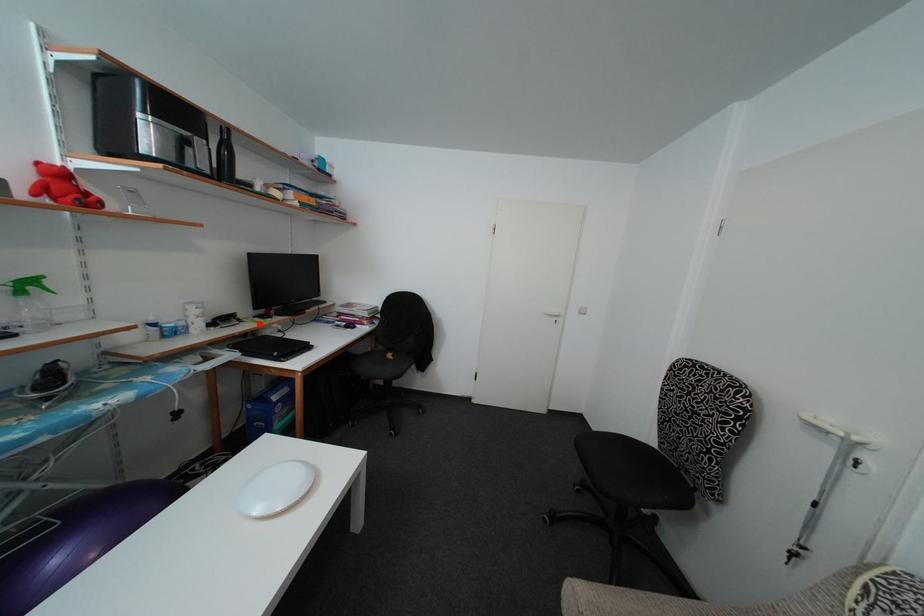
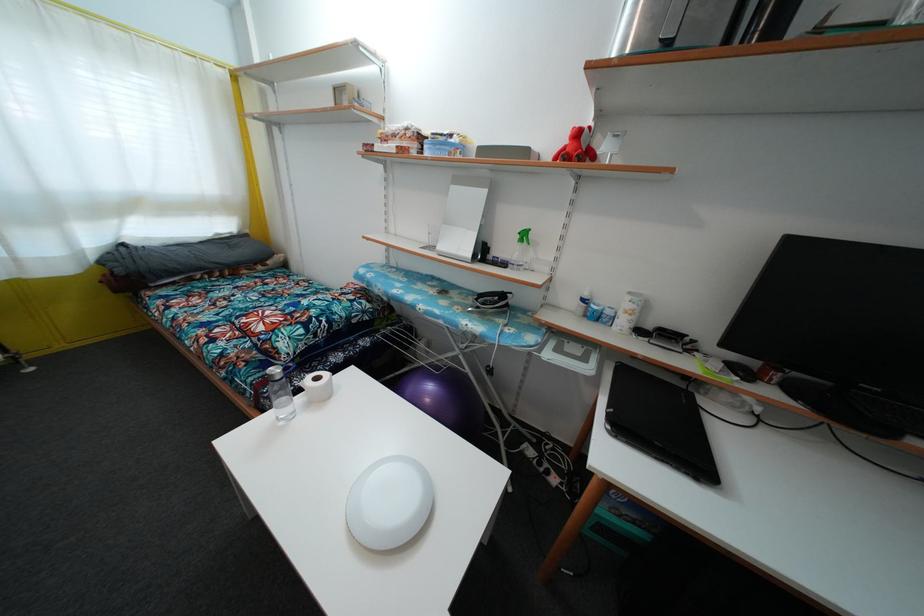
Find the pixel in the second image that matches the highlighted location in the first image.

(728, 369)